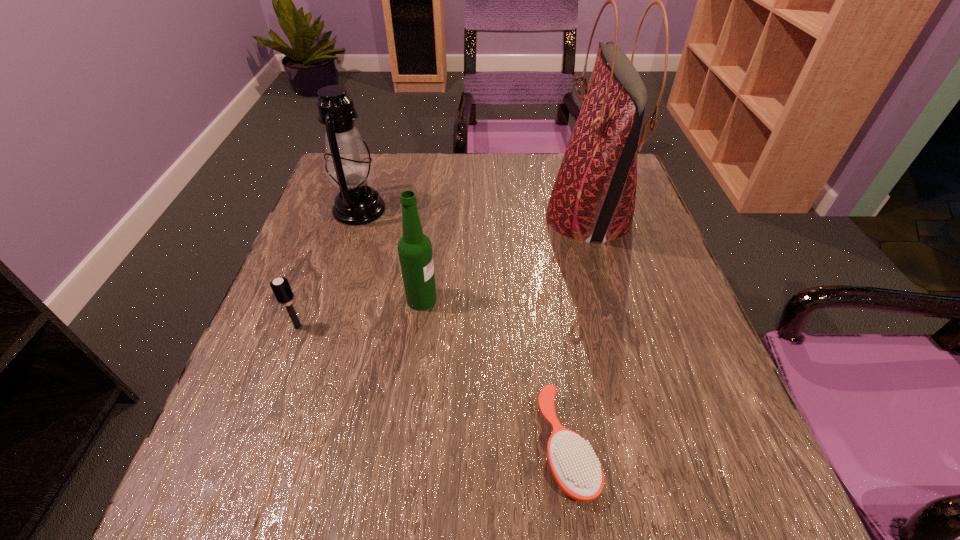
The height and width of the screenshot is (540, 960). What are the coordinates of `handbag` in the screenshot? It's located at (593, 198).

Find the location of `oil lamp`. oil lamp is located at coordinates (349, 167).

Where is `the third object from left to right`? The image size is (960, 540). the third object from left to right is located at coordinates (415, 253).

Locate an element on the screen. the third tallest object is located at coordinates (415, 253).

The height and width of the screenshot is (540, 960). Identify the location of the fourth tallest object. (281, 288).

Locate an element on the screen. This screenshot has height=540, width=960. the second nearest object is located at coordinates (281, 288).

You are a GUI agent. You are given a task and a screenshot of the screen. Output one action in this format:
    pyautogui.click(x=<x>, y=<y>)
    Task: Click on the nearest object
    
    Given the screenshot: What is the action you would take?
    pyautogui.click(x=573, y=462)

The height and width of the screenshot is (540, 960). Find the location of `the shortest object`. the shortest object is located at coordinates (573, 462).

I want to click on free spot located 0.150m on the front of the handbag, so click(x=617, y=317).

Identify the location of vacant region located 0.200m on the front of the oil lamp. (333, 291).